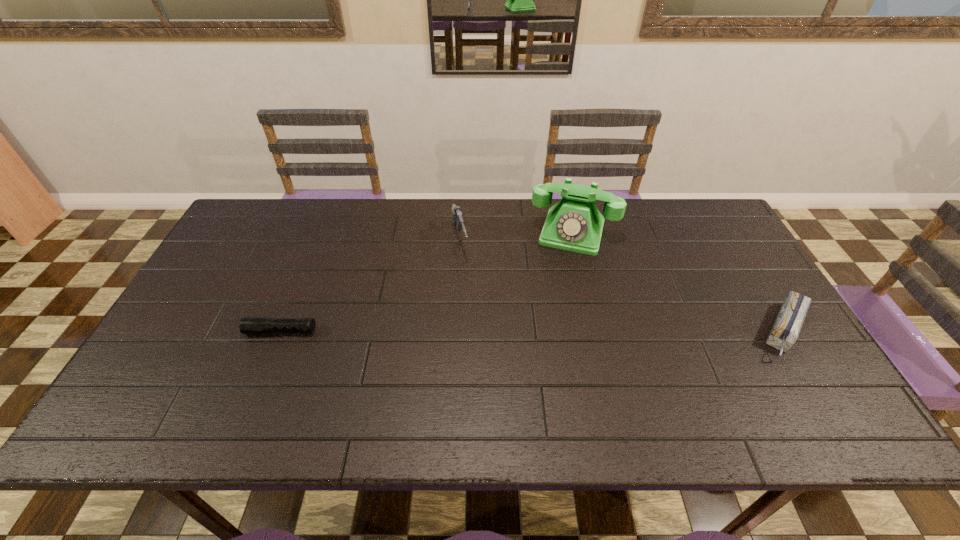
Find the location of a particular element. This screenshot has height=540, width=960. free space located 0.240m on the left of the pencil box is located at coordinates (660, 331).

Locate an element on the screen. The height and width of the screenshot is (540, 960). vacant space located 0.210m at the barrel of the second object from left to right is located at coordinates point(477,315).

You are a GUI agent. You are given a task and a screenshot of the screen. Output one action in this format:
    pyautogui.click(x=<x>, y=<y>)
    Task: Click on the vacant area situated at the barrel of the second object from left to right
    
    Given the screenshot: What is the action you would take?
    481,330

Locate an element on the screen. The height and width of the screenshot is (540, 960). free spot located 0.380m at the barrel of the second object from left to right is located at coordinates (492, 368).

You are a GUI agent. You are given a task and a screenshot of the screen. Output one action in this format:
    pyautogui.click(x=<x>, y=<y>)
    Task: Click on the vacant space situated 0.220m on the dial of the second object from right to left
    
    Given the screenshot: What is the action you would take?
    tap(550, 306)

You are a GUI agent. You are given a task and a screenshot of the screen. Output one action in this format:
    pyautogui.click(x=<x>, y=<y>)
    Task: Click on the free spot located on the dial of the second object from right to left
    The image size is (960, 540).
    Given the screenshot: What is the action you would take?
    pyautogui.click(x=553, y=296)

This screenshot has width=960, height=540. Identify the location of vacant space located on the dial of the second object from right to left. (558, 279).

At what (x,y) coordinates should I click in order to perform the action: click on gun at the far edge. Please return your answer as a coordinate pair (x, y). This screenshot has height=540, width=960. Looking at the image, I should click on (457, 217).

At what (x,y) coordinates should I click in order to perform the action: click on telephone located in the far edge section of the desktop. Please return your answer as a coordinate pair (x, y). Looking at the image, I should click on (574, 224).

Find the location of `object that is positioned at the right edge`. object that is positioned at the right edge is located at coordinates [785, 331].